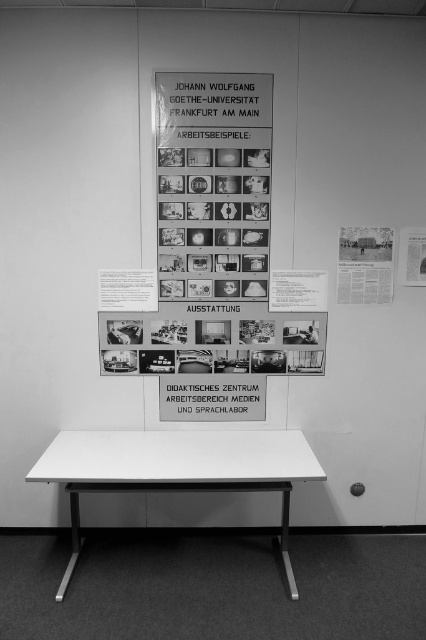
You are standing in the room shown in the image and want to place a small notebook on the white matte table at center. Based on the coordinates provided, can you determine the exact location to place it?

The white matte table at center is located at coordinates point (x=176, y=468), so you should place the notebook there.

You are standing in the room and want to place a book on the white matte table at center. However, there is a white paper at upper right in the scene. Which object is closer to you so that you can place the book on it?

The white matte table at center is closer to the viewer than the white paper at upper right, so you can place the book on the white matte table at center.